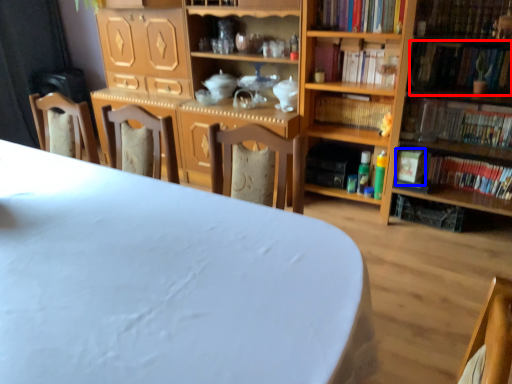
Question: Which object appears closest to the camera in this image, book (highlighted by a red box) or paperback book (highlighted by a blue box)?

Choices:
 (A) book
 (B) paperback book

Answer: (A)